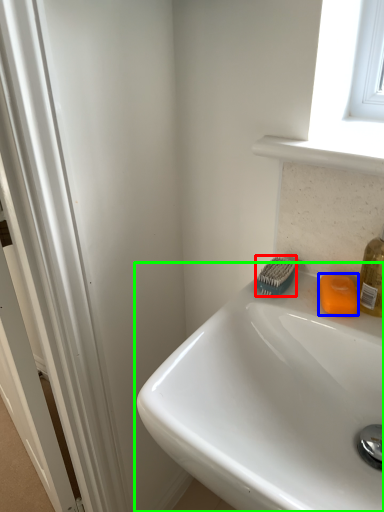
Question: Based on their relative distances, which object is farther from brush (highlighted by a red box)? Choose from soap (highlighted by a blue box) and sink (highlighted by a green box).

Choices:
 (A) soap
 (B) sink

Answer: (B)